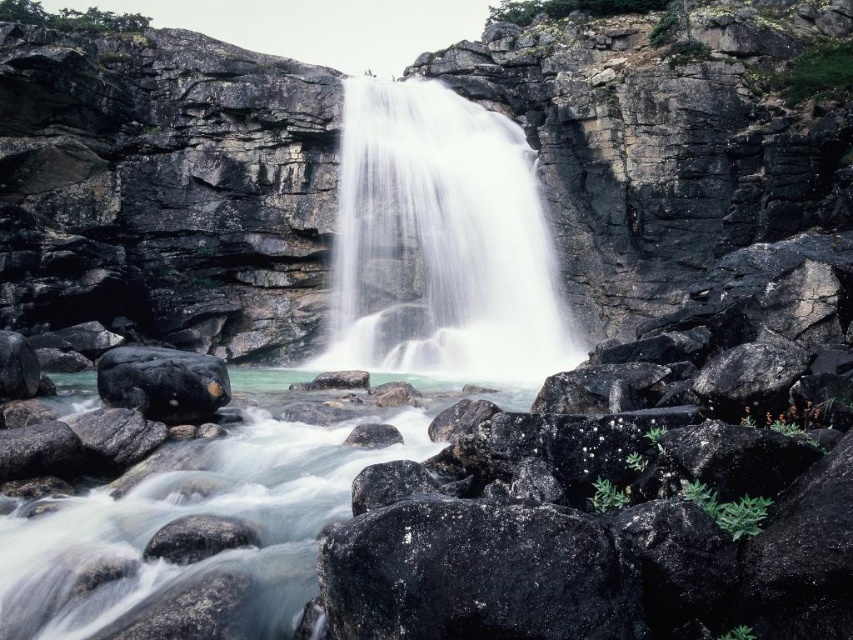
Is white smooth waterfall at center bigger than black smooth rock at lower left?

Yes, white smooth waterfall at center is bigger than black smooth rock at lower left.

Between point (505, 132) and point (97, 362), which one is positioned in front?

Point (97, 362) is in front.

Where is `white smooth waterfall at center`? The height and width of the screenshot is (640, 853). white smooth waterfall at center is located at coordinates (440, 243).

Does white smooth waterfall at center have a greater width compared to clear water at center?

In fact, white smooth waterfall at center might be narrower than clear water at center.

Does point (364, 292) come in front of point (117, 609)?

No.

Describe the element at coordinates (440, 243) in the screenshot. This screenshot has height=640, width=853. I see `white smooth waterfall at center` at that location.

Locate an element on the screen. Image resolution: width=853 pixels, height=640 pixels. white smooth waterfall at center is located at coordinates (440, 243).

Does clear water at center have a greater height compared to black smooth rock at lower left?

No.

Does clear water at center have a greater width compared to black smooth rock at lower left?

Indeed, clear water at center has a greater width compared to black smooth rock at lower left.

Locate an element on the screen. Image resolution: width=853 pixels, height=640 pixels. clear water at center is located at coordinates (193, 513).

Where is `clear water at center`? clear water at center is located at coordinates (193, 513).